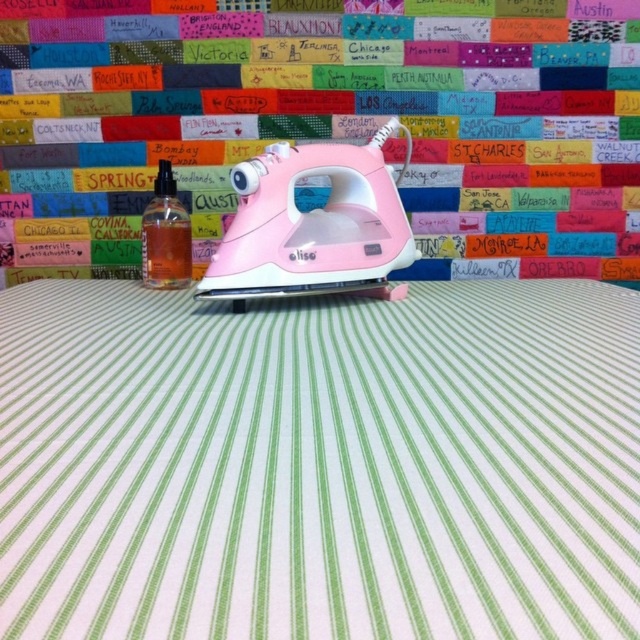
Does white striped fabric at center appear under translucent orange liquid at center?

Yes.

The image size is (640, 640). In order to click on white striped fabric at center in this screenshot , I will do `click(320, 464)`.

Who is more forward, (625, 292) or (179, 241)?

Positioned in front is point (625, 292).

This screenshot has width=640, height=640. Find the location of `white striped fabric at center`. white striped fabric at center is located at coordinates (320, 464).